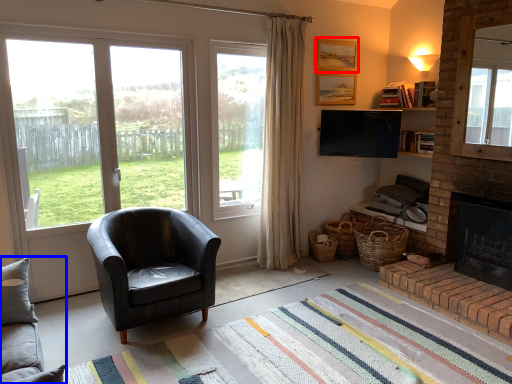
Question: Which of the following is the farthest to the observer, picture frame (highlighted by a red box) or studio couch (highlighted by a blue box)?

Choices:
 (A) picture frame
 (B) studio couch

Answer: (A)